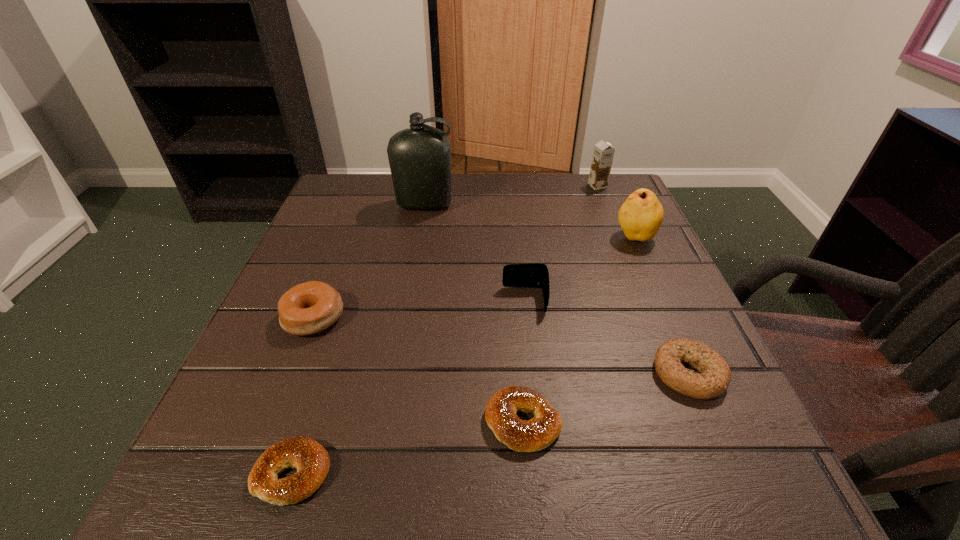
The width and height of the screenshot is (960, 540). I want to click on vacant point located on the left of the farthest object, so click(x=438, y=186).

Where is `blank space located 0.230m on the back of the pear`? This screenshot has width=960, height=540. blank space located 0.230m on the back of the pear is located at coordinates (609, 178).

Find the location of `vacant region located on the outer surface of the wallet`. vacant region located on the outer surface of the wallet is located at coordinates (299, 300).

You are a GUI agent. You are given a task and a screenshot of the screen. Output one action in this format:
    pyautogui.click(x=<x>, y=<y>)
    Task: Click on the vacant position located 0.330m on the outer surface of the wallet
    Image resolution: width=960 pixels, height=540 pixels.
    Given the screenshot: What is the action you would take?
    pyautogui.click(x=330, y=300)

Image resolution: width=960 pixels, height=540 pixels. I want to click on blank space located 0.160m on the outer surface of the wallet, so click(420, 300).

Where is `vacant region located 0.240m on the back of the farthest bagel`? The image size is (960, 540). vacant region located 0.240m on the back of the farthest bagel is located at coordinates (349, 226).

Where is `vacant space located 0.300m on the left of the rightmost bagel`? The image size is (960, 540). vacant space located 0.300m on the left of the rightmost bagel is located at coordinates (468, 373).

Where is `free region located on the right of the second bagel from right to left`? Image resolution: width=960 pixels, height=540 pixels. free region located on the right of the second bagel from right to left is located at coordinates (636, 422).

At what (x,y) coordinates should I click in order to perform the action: click on bottle present at the far edge. Please return your answer as a coordinate pair (x, y). This screenshot has width=960, height=540. Looking at the image, I should click on (419, 157).

Locate an element on the screen. chocolate milk located in the far edge section of the desktop is located at coordinates (603, 153).